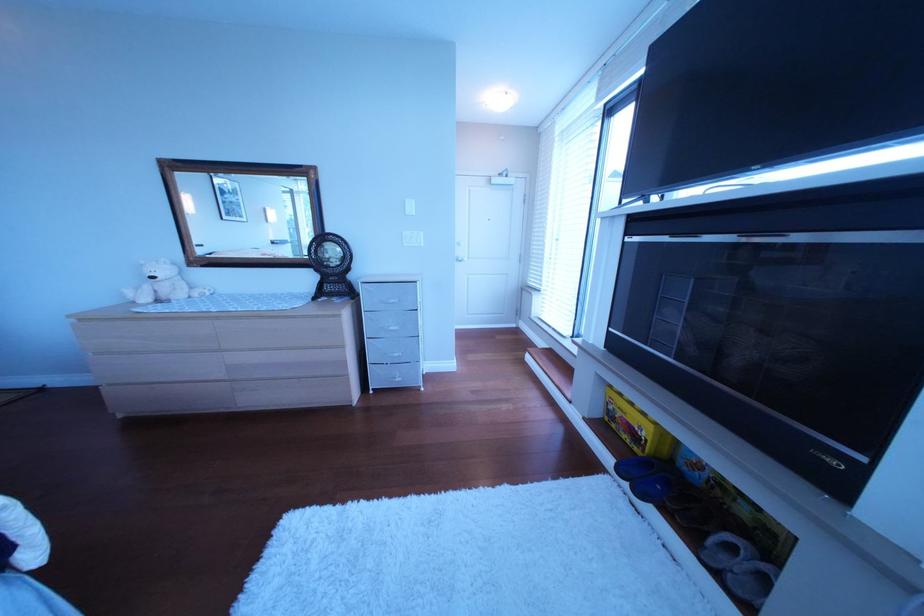
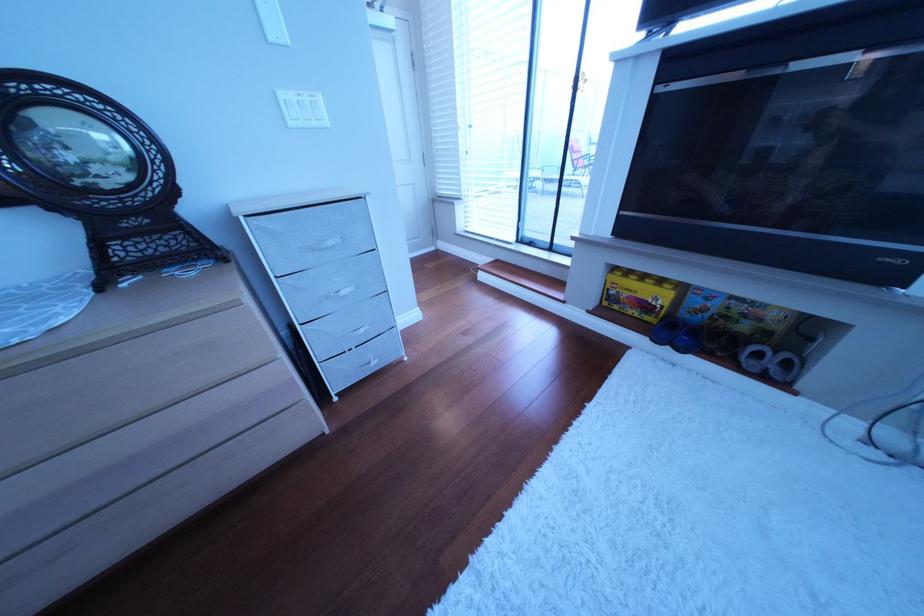
In the second image, find the point that corresponds to (x=635, y=416) in the first image.

(640, 296)